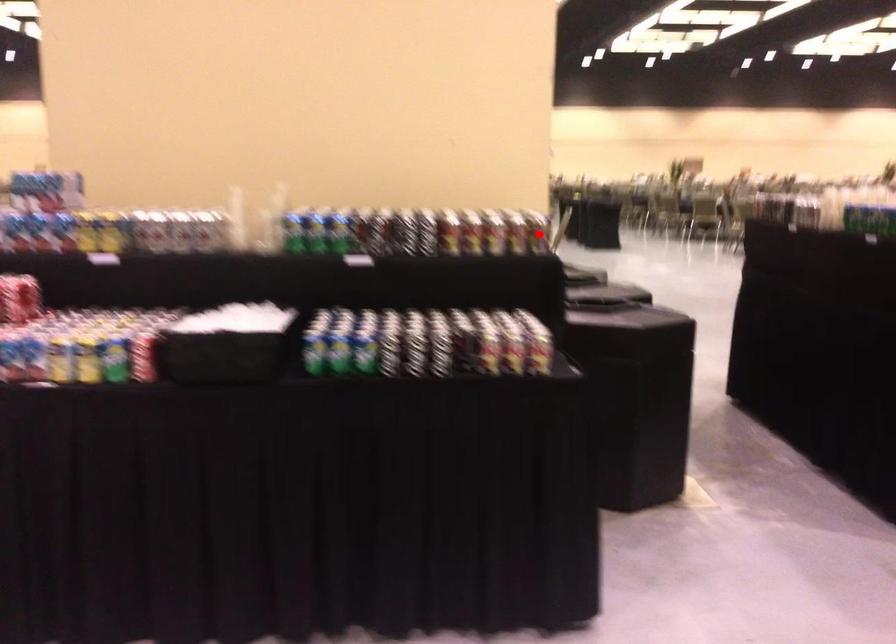
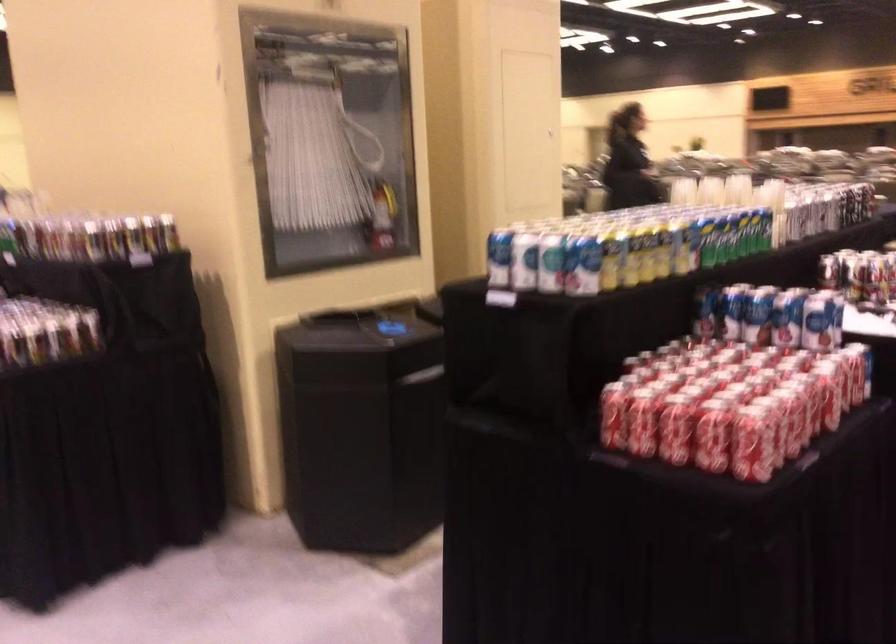
Question: I am providing you with two images of the same scene from different viewpoints. In image1, a red point is highlighted. Considering the same 3D point in image2, which of the following is correct?

Choices:
 (A) It is closer
 (B) It is farther

Answer: (B)